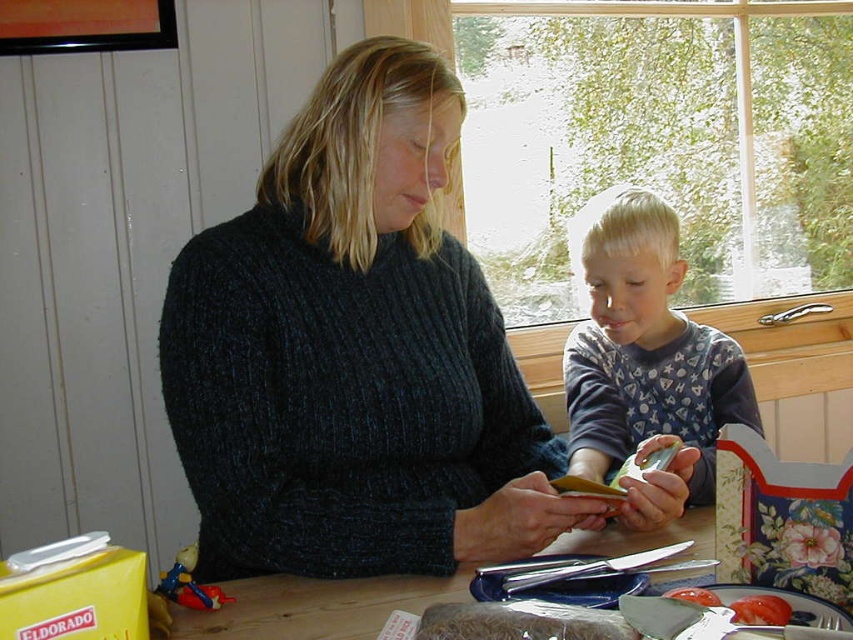
You are standing at the point with coordinates point (177,620) and want to move to the point with coordinates point (410,470). Which direction should you move to reach your destination?

To reach point (410,470) from point (177,620), you should move towards the upper left direction since point (410,470) is behind point (177,620).

Looking at this image, you are a chef preparing a meal and need to choose between the smooth tomato at lower right and the tomatosmoothfood at right. Which one should you pick if you need a larger tomato for your recipe?

You should pick the tomatosmoothfood at right because it is larger than the smooth tomato at lower right.

You are standing in the room and want to reach the point at coordinates point (764, 609). Can you estimate how far you need to walk to get there?

The distance between you and point (764, 609) is 65.39 centimeters, so you need to walk approximately 65.4 centimeters to reach it.